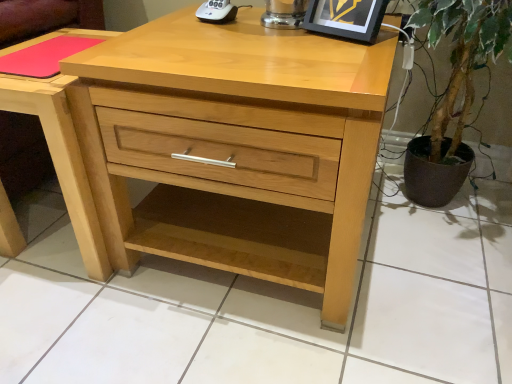
Identify the location of white plastic remote control at upper center. [217, 12].

This screenshot has height=384, width=512. I want to click on light wood nightstand at center, so click(62, 158).

Does pink matte mousepad at upper left appear on the right side of white plastic remote control at upper center?

No, pink matte mousepad at upper left is not to the right of white plastic remote control at upper center.

From a real-world perspective, which is physically above, pink matte mousepad at upper left or white plastic remote control at upper center?

white plastic remote control at upper center, from a real-world perspective.

Is the depth of pink matte mousepad at upper left less than that of white plastic remote control at upper center?

Yes, pink matte mousepad at upper left is closer to the camera.

From the image's perspective, is pink matte mousepad at upper left above or below white plastic remote control at upper center?

Clearly, from the image's perspective, pink matte mousepad at upper left is below white plastic remote control at upper center.

Can you tell me how much pink matte mousepad at upper left and light wood nightstand at center differ in facing direction?

There is a 0.957-degree angle between the facing directions of pink matte mousepad at upper left and light wood nightstand at center.

Considering the sizes of pink matte mousepad at upper left and light wood nightstand at center in the image, is pink matte mousepad at upper left taller or shorter than light wood nightstand at center?

Clearly, pink matte mousepad at upper left is shorter compared to light wood nightstand at center.

Does pink matte mousepad at upper left have a greater width compared to light wood nightstand at center?

In fact, pink matte mousepad at upper left might be narrower than light wood nightstand at center.

Could you tell me if pink matte mousepad at upper left is facing natural wood chest of drawers at center?

No, pink matte mousepad at upper left does not turn towards natural wood chest of drawers at center.

Considering the positions of point (8, 61) and point (253, 197), is point (8, 61) closer or farther from the camera than point (253, 197)?

Point (8, 61) is farther from the camera than point (253, 197).

Looking at this image, does pink matte mousepad at upper left lie in front of natural wood chest of drawers at center?

No, pink matte mousepad at upper left is behind natural wood chest of drawers at center.

How many degrees apart are the facing directions of white plastic remote control at upper center and matte black picture frame at upper right?

13 degrees separate the facing orientations of white plastic remote control at upper center and matte black picture frame at upper right.

Looking at this image, is white plastic remote control at upper center at the right side of matte black picture frame at upper right?

No, white plastic remote control at upper center is not to the right of matte black picture frame at upper right.

From the image's perspective, which object appears higher, white plastic remote control at upper center or matte black picture frame at upper right?

white plastic remote control at upper center.

Which point is more distant from viewer, [217,0] or [340,10]?

The point [217,0] is farther.

Is natural wood chest of drawers at center in front of or behind white plastic remote control at upper center in the image?

Clearly, natural wood chest of drawers at center is in front of white plastic remote control at upper center.

From a real-world perspective, between natural wood chest of drawers at center and white plastic remote control at upper center, who is vertically lower?

natural wood chest of drawers at center.

Is point (238, 142) closer to viewer compared to point (213, 9)?

Yes, point (238, 142) is in front of point (213, 9).

Which of these two, natural wood chest of drawers at center or white plastic remote control at upper center, is wider?

With larger width is natural wood chest of drawers at center.

Does white plastic remote control at upper center appear on the left side of natural wood chest of drawers at center?

Correct, you'll find white plastic remote control at upper center to the left of natural wood chest of drawers at center.

Which object is further away from the camera, white plastic remote control at upper center or natural wood chest of drawers at center?

Positioned behind is white plastic remote control at upper center.

Is white plastic remote control at upper center facing away from natural wood chest of drawers at center?

white plastic remote control at upper center is not turned away from natural wood chest of drawers at center.

Which is nearer, (220, 16) or (137, 157)?

Clearly, point (220, 16) is more distant from the camera than point (137, 157).

From a real-world perspective, which is physically below, pink matte mousepad at upper left or matte black picture frame at upper right?

pink matte mousepad at upper left, from a real-world perspective.

Looking at this image, from the image's perspective, which is above, pink matte mousepad at upper left or matte black picture frame at upper right?

matte black picture frame at upper right appears higher in the image.

Is pink matte mousepad at upper left not near matte black picture frame at upper right?

Actually, pink matte mousepad at upper left and matte black picture frame at upper right are a little close together.

Is pink matte mousepad at upper left further to the viewer compared to matte black picture frame at upper right?

Yes.

Image resolution: width=512 pixels, height=384 pixels. I want to click on pad that appears below the white plastic remote control at upper center (from the image's perspective), so 44,56.

You are a GUI agent. You are given a task and a screenshot of the screen. Output one action in this format:
    pyautogui.click(x=<x>, y=<y>)
    Task: Click on the pad behind the light wood nightstand at center
    Image resolution: width=512 pixels, height=384 pixels.
    Given the screenshot: What is the action you would take?
    pyautogui.click(x=44, y=56)

From the image, which object appears to be farther from matte black picture frame at upper right, white plastic remote control at upper center or natural wood chest of drawers at center?

natural wood chest of drawers at center is further to matte black picture frame at upper right.

Consider the image. From the image, which object appears to be nearer to matte black picture frame at upper right, natural wood chest of drawers at center or light wood nightstand at center?

Among the two, natural wood chest of drawers at center is located nearer to matte black picture frame at upper right.

From the image, which object appears to be nearer to natural wood chest of drawers at center, pink matte mousepad at upper left or white plastic remote control at upper center?

pink matte mousepad at upper left.

From the image, which object appears to be nearer to light wood nightstand at center, matte black picture frame at upper right or natural wood chest of drawers at center?

natural wood chest of drawers at center is positioned closer to the anchor light wood nightstand at center.

From the image, which object appears to be nearer to pink matte mousepad at upper left, matte black picture frame at upper right or light wood nightstand at center?

Among the two, light wood nightstand at center is located nearer to pink matte mousepad at upper left.

When comparing their distances from matte black picture frame at upper right, does white plastic remote control at upper center or light wood nightstand at center seem closer?

white plastic remote control at upper center is closer to matte black picture frame at upper right.

When comparing their distances from pink matte mousepad at upper left, does natural wood chest of drawers at center or white plastic remote control at upper center seem further?

Among the two, natural wood chest of drawers at center is located further to pink matte mousepad at upper left.

In the scene shown: Which object lies further to the anchor point light wood nightstand at center, natural wood chest of drawers at center or matte black picture frame at upper right?

matte black picture frame at upper right.

Identify the location of nightstand between pink matte mousepad at upper left and white plastic remote control at upper center from left to right. pyautogui.click(x=62, y=158).

Find the location of a particular element. This screenshot has height=384, width=512. gadget between pink matte mousepad at upper left and matte black picture frame at upper right in the horizontal direction is located at coordinates (217, 12).

This screenshot has width=512, height=384. Identify the location of gadget located between light wood nightstand at center and matte black picture frame at upper right in the left-right direction. (217, 12).

I want to click on chest of drawers between light wood nightstand at center and matte black picture frame at upper right in the horizontal direction, so point(234,147).